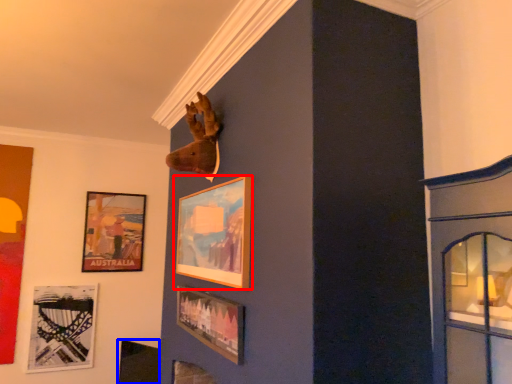
Question: Which object is further to the camera taking this photo, picture frame (highlighted by a red box) or picture frame (highlighted by a blue box)?

Choices:
 (A) picture frame
 (B) picture frame

Answer: (B)